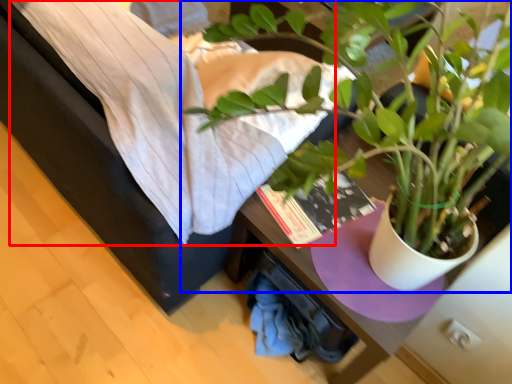
Question: Which point is closer to the camera, sheet (highlighted by a red box) or houseplant (highlighted by a blue box)?

Choices:
 (A) sheet
 (B) houseplant

Answer: (B)